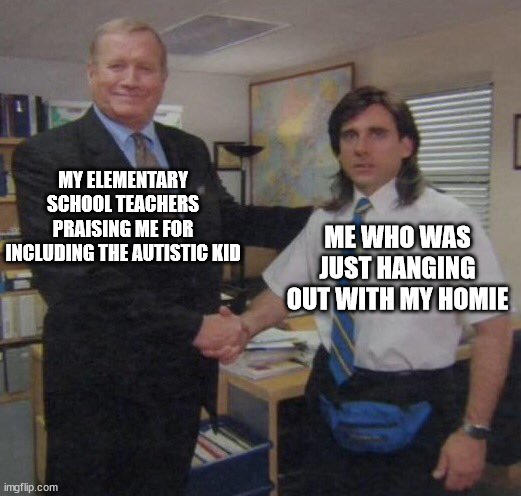
At what (x,y) coordinates should I click in order to perform the action: click on lamp. Please return your answer as a coordinate pair (x, y). Looking at the image, I should click on (248, 149).